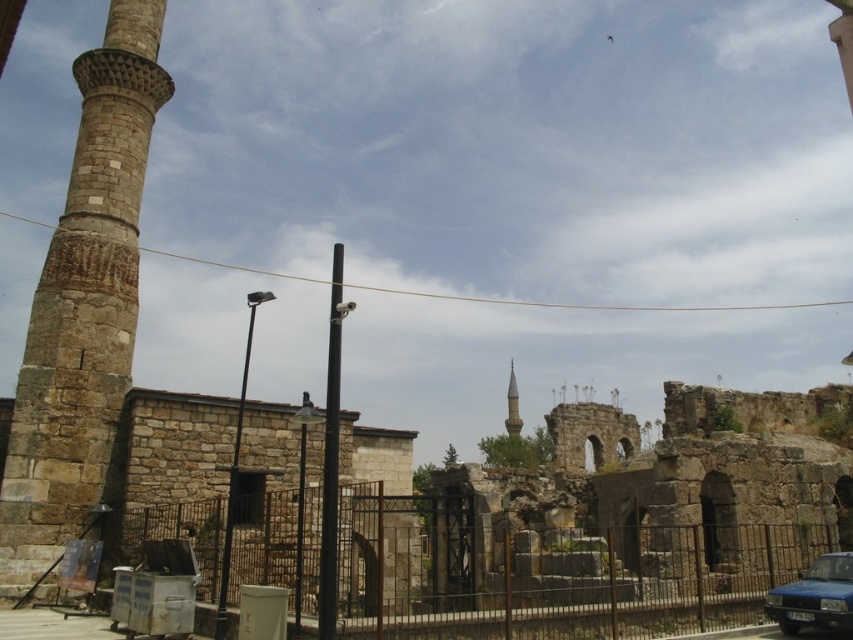
You are a delivery driver who needs to park your blue metallic car at lower right as close as possible to the smooth stone minaret at center without crossing the fence. Based on the scene description, what is the minimum distance you can achieve between your car and the minaret?

The blue metallic car at lower right and smooth stone minaret at center are 496.27 feet apart from each other. Since you cannot cross the fence, the minimum distance achievable is 496.27 feet.

You are a city planner assessing the historical site. You need to install a new security camera on the tallest structure between the rusty metal fence at center and the smooth stone minaret at center. Which structure should you choose?

The smooth stone minaret at center is taller than the rusty metal fence at center, so you should install the new security camera on the smooth stone minaret at center.

You are standing in front of the historical site and want to take a photo that includes both the point at coordinates (833, 625) and the point at (511, 365). Which point should you focus on first to ensure both are in focus?

You should focus on the point at (511, 365) first because it is farther from the viewer than the point at (833, 625). By focusing on the farther point, both points will be within the depth of field and in focus.